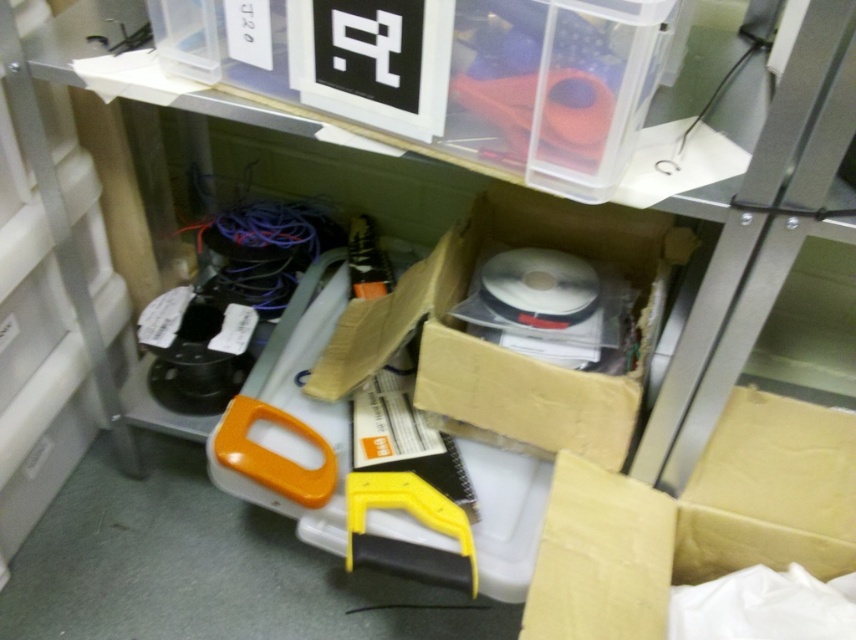
Question: Among these points, which one is farthest from the camera?

Choices:
 (A) (767, 396)
 (B) (590, 99)
 (C) (461, 237)
 (D) (346, 522)

Answer: (C)

Question: Is the position of brown cardboard box at lower right less distant than that of translucent plastic scissors at upper center?

Choices:
 (A) no
 (B) yes

Answer: (A)

Question: Can you confirm if cardboard box at center is bigger than translucent plastic scissors at upper center?

Choices:
 (A) no
 (B) yes

Answer: (B)

Question: Estimate the real-world distances between objects in this image. Which object is farther from the cardboard box at center?

Choices:
 (A) translucent plastic scissors at upper center
 (B) brown cardboard box at lower right

Answer: (A)

Question: Which point appears closest to the camera in this image?

Choices:
 (A) (383, 502)
 (B) (532, 77)

Answer: (B)

Question: Where is brown cardboard box at lower right located in relation to cardboard box at center in the image?

Choices:
 (A) below
 (B) above

Answer: (A)